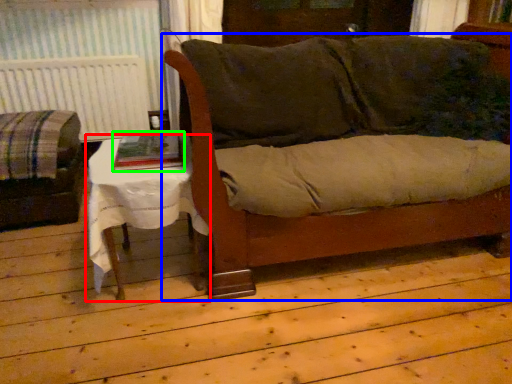
Question: Which object is the closest to the table (highlighted by a red box)? Choose among these: couch (highlighted by a blue box) or book (highlighted by a green box).

Choices:
 (A) couch
 (B) book

Answer: (B)